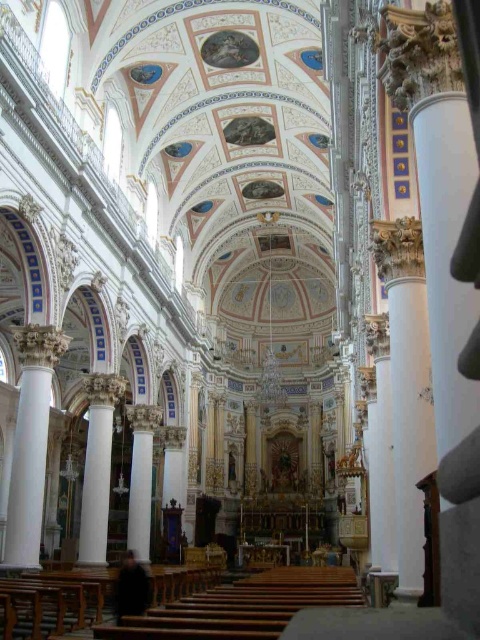
You are an architect inspecting the church interior. You notice the white marble column at left and the white marble column at center. Based on their positions, which one is positioned higher up in the space?

The white marble column at left is located above the white marble column at center, so it is positioned higher up in the space.

You are standing inside the grand church and looking at two points marked on the ceiling. The first point is at coordinates point (36, 552) and the second is at point (129, 406). Which of these two points is closer to your current position?

Point (36, 552) is closer to the camera than point (129, 406), so the first point is closer to your current position.